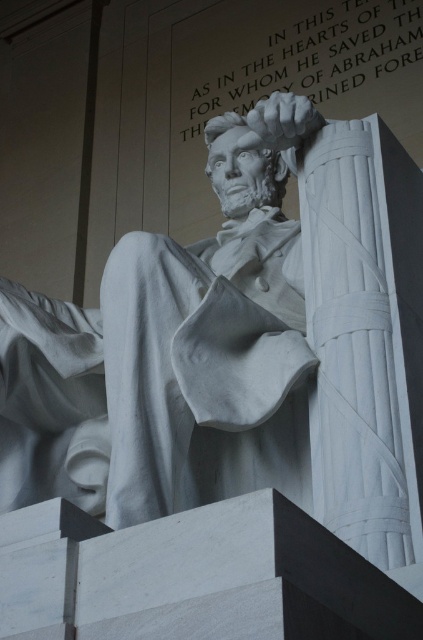
You are standing in front of the Abraham Lincoln Memorial and want to take a photo that includes both the statue and the inscription. You notice two specific points marked as point 1 at coordinates [297,282] and point 2 at [329,68]. Which point is closer to you when you are facing the memorial?

Point 1 at coordinates [297,282] is closer to the viewer than point 2 at [329,68].

You are standing in front of the Abraham Lincoln Memorial and want to take a photo of the statue. The camera you have can only focus on objects within a 0.5 meter radius of the center point. Given that the white marble robe at center is positioned at coordinates 0.578, 0.485, will the robe be in focus if you center your camera at coordinates 0.5, 0.5?

The white marble robe at center is located at coordinates [205,369]. The camera is centered at [211,320]. The distance between the robe and the center is sqrt of the squared differences in x and y coordinates. Calculating the distance between the two points, the distance is sqrt of 0.078 squared plus 0.015 squared, which is approximately sqrt of 0.006084 plus 0.000225 equals sqrt of 0.006309, which is approximately 0.0794 meters. Since the camera can focus within 0.5 meters, the robe will be in focus.